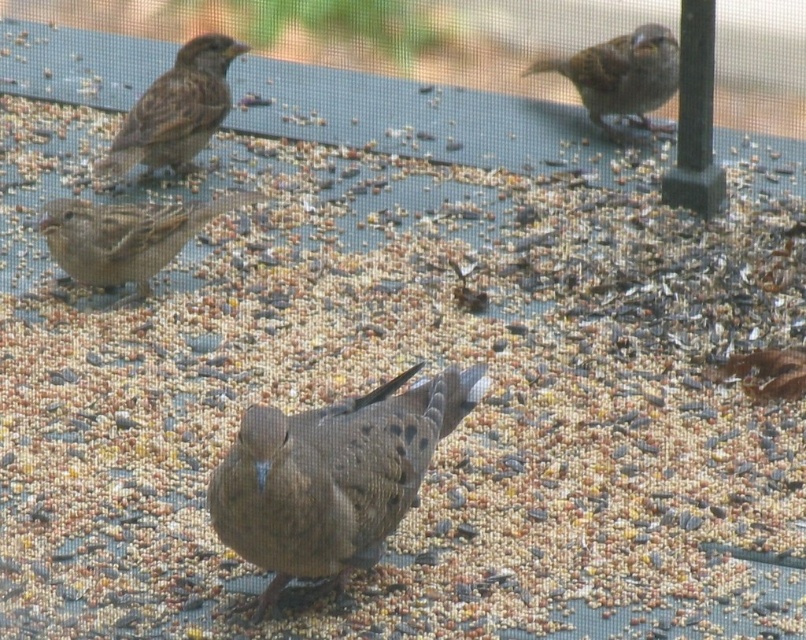
You are a birdwatcher observing the scene. You notice two sparrows, the brown speckled sparrow at center and the brown matte sparrow at upper right. Which sparrow is located to the left of the other?

The brown speckled sparrow at center is positioned on the left side of brown matte sparrow at upper right.

Based on the coordinates provided, where is the brown speckled sparrow at center located in the image?

The brown speckled sparrow at center is located at the 2D coordinates point (333, 476).